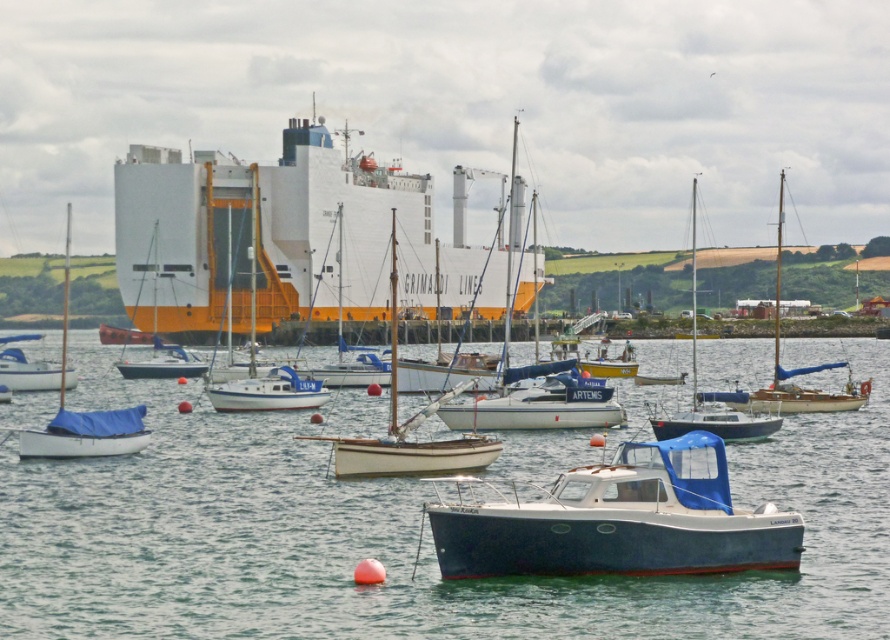
Question: Is blue matte boat at center smaller than white matte sailboat at center?

Choices:
 (A) yes
 (B) no

Answer: (A)

Question: Based on their relative distances, which object is nearer to the white wood sailboat at center?

Choices:
 (A) blue water at center
 (B) blue matte boat at center
 (C) white matte sailboat at left
 (D) white matte cargo ship at center

Answer: (A)

Question: Which object is positioned farthest from the white matte cargo ship at center?

Choices:
 (A) blue matte boat at center
 (B) white matte sailboat at center

Answer: (A)

Question: From the image, what is the correct spatial relationship of white matte cargo ship at center in relation to white matte sailboat at center?

Choices:
 (A) left
 (B) right

Answer: (A)

Question: Can you confirm if white matte cargo ship at center is positioned below blue matte boat at center?

Choices:
 (A) no
 (B) yes

Answer: (A)

Question: Which point appears closest to the camera in this image?

Choices:
 (A) 638,547
 (B) 359,464

Answer: (A)